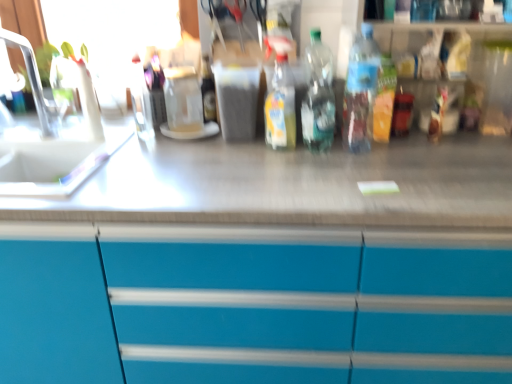
This screenshot has height=384, width=512. Identify the location of transparent plastic bottle at center, which ranks as the second bottle in right-to-left order. (318, 96).

The height and width of the screenshot is (384, 512). What do you see at coordinates (141, 100) in the screenshot? I see `clear plastic bottle at upper center, marked as the 1th bottle in a left-to-right arrangement` at bounding box center [141, 100].

You are a GUI agent. You are given a task and a screenshot of the screen. Output one action in this format:
    pyautogui.click(x=<x>, y=<y>)
    Task: Click on the transparent glass jar at center
    This screenshot has width=512, height=384.
    Given the screenshot: What is the action you would take?
    pyautogui.click(x=183, y=99)

Describe the element at coordinates (252, 305) in the screenshot. The height and width of the screenshot is (384, 512). I see `blue glossy cabinet at lower center` at that location.

The image size is (512, 384). What do you see at coordinates (361, 91) in the screenshot?
I see `translucent plastic bottle at center, which ranks as the fourth bottle in left-to-right order` at bounding box center [361, 91].

This screenshot has height=384, width=512. I want to click on translucent plastic bottle at center, the 3th bottle positioned from the right, so click(x=281, y=106).

Can you confirm if blue glossy cabinet at lower center is thinner than transparent glass jar at center?

No.

From the image's perspective, which is below, blue glossy cabinet at lower center or transparent glass jar at center?

blue glossy cabinet at lower center is shown below in the image.

In the scene shown: Is blue glossy cabinet at lower center in contact with transparent glass jar at center?

No, blue glossy cabinet at lower center is not in contact with transparent glass jar at center.

Can transparent glass jar at center be found inside blue glossy cabinet at lower center?

No, transparent glass jar at center is not inside blue glossy cabinet at lower center.

Is transparent plastic bottle at center, positioned as the third bottle in left-to-right order, positioned beyond the bounds of white plastic faucet at left?

Yes, transparent plastic bottle at center, positioned as the third bottle in left-to-right order, is not within white plastic faucet at left.

Considering the relative sizes of transparent plastic bottle at center, positioned as the third bottle in left-to-right order, and white plastic faucet at left in the image provided, is transparent plastic bottle at center, positioned as the third bottle in left-to-right order, shorter than white plastic faucet at left?

Yes.

Considering the positions of objects transparent plastic bottle at center, which ranks as the second bottle in right-to-left order, and white plastic faucet at left in the image provided, who is more to the left, transparent plastic bottle at center, which ranks as the second bottle in right-to-left order, or white plastic faucet at left?

From the viewer's perspective, white plastic faucet at left appears more on the left side.

Measure the distance from translucent plastic bottle at center, the 3th bottle positioned from the right, to transparent glass jar at center.

12.30 inches.

Is translucent plastic bottle at center, the 3th bottle positioned from the right, inside the boundaries of transparent glass jar at center, or outside?

translucent plastic bottle at center, the 3th bottle positioned from the right, cannot be found inside transparent glass jar at center.

Is point (292, 86) behind point (190, 110)?

No, (292, 86) is closer to viewer.

From the image's perspective, count 1st bottles downward from the transparent glass jar at center and point to it. Please provide its 2D coordinates.

[(281, 106)]

Is clear plastic bottle at upper center, marked as the 1th bottle in a left-to-right arrangement, thinner than transparent glass jar at center?

Yes.

Looking at this image, from the image's perspective, is clear plastic bottle at upper center, marked as the 1th bottle in a left-to-right arrangement, located above transparent glass jar at center?

Yes, from the image's perspective, clear plastic bottle at upper center, marked as the 1th bottle in a left-to-right arrangement, is above transparent glass jar at center.

Between clear plastic bottle at upper center, marked as the 1th bottle in a left-to-right arrangement, and transparent glass jar at center, which one has less height?

With less height is transparent glass jar at center.

Looking at this image, is clear plastic bottle at upper center, the fourth bottle when ordered from right to left, located outside transparent glass jar at center?

Yes, clear plastic bottle at upper center, the fourth bottle when ordered from right to left, is located beyond the bounds of transparent glass jar at center.

Considering the sizes of objects translucent plastic bottle at center, positioned as the 1th bottle in right-to-left order, and transparent plastic bottle at center, which ranks as the second bottle in right-to-left order, in the image provided, who is bigger, translucent plastic bottle at center, positioned as the 1th bottle in right-to-left order, or transparent plastic bottle at center, which ranks as the second bottle in right-to-left order,?

With larger size is translucent plastic bottle at center, positioned as the 1th bottle in right-to-left order.

Considering the relative sizes of translucent plastic bottle at center, positioned as the 1th bottle in right-to-left order, and transparent plastic bottle at center, which ranks as the second bottle in right-to-left order, in the image provided, is translucent plastic bottle at center, positioned as the 1th bottle in right-to-left order, shorter than transparent plastic bottle at center, which ranks as the second bottle in right-to-left order,?

In fact, translucent plastic bottle at center, positioned as the 1th bottle in right-to-left order, may be taller than transparent plastic bottle at center, which ranks as the second bottle in right-to-left order.

From a real-world perspective, which object stands above the other?

translucent plastic bottle at center, which ranks as the fourth bottle in left-to-right order, from a real-world perspective.

How many degrees apart are the facing directions of white plastic faucet at left and translucent plastic bottle at center, which is the 2th bottle from left to right?

19.1 degrees.

Would you say white plastic faucet at left is a long distance from translucent plastic bottle at center, the 3th bottle positioned from the right?

Actually, white plastic faucet at left and translucent plastic bottle at center, the 3th bottle positioned from the right, are a little close together.

Considering the sizes of objects white plastic faucet at left and translucent plastic bottle at center, which is the 2th bottle from left to right, in the image provided, who is wider, white plastic faucet at left or translucent plastic bottle at center, which is the 2th bottle from left to right,?

Wider between the two is white plastic faucet at left.

Is white plastic faucet at left facing away from translucent plastic bottle at center, the 3th bottle positioned from the right?

No, white plastic faucet at left is not facing away from translucent plastic bottle at center, the 3th bottle positioned from the right.

Which of these two, transparent glass jar at center or translucent plastic bottle at center, the 3th bottle positioned from the right, stands taller?

Standing taller between the two is translucent plastic bottle at center, the 3th bottle positioned from the right.

Could you tell me if transparent glass jar at center is facing translucent plastic bottle at center, which is the 2th bottle from left to right?

No, transparent glass jar at center does not turn towards translucent plastic bottle at center, which is the 2th bottle from left to right.

Is transparent glass jar at center positioned in front of translucent plastic bottle at center, the 3th bottle positioned from the right?

No, it is not.

Does transparent glass jar at center have a lesser width compared to translucent plastic bottle at center, the 3th bottle positioned from the right?

In fact, transparent glass jar at center might be wider than translucent plastic bottle at center, the 3th bottle positioned from the right.

The image size is (512, 384). Identify the location of beverage above the blue glossy cabinet at lower center (from the image's perspective). (183, 99).

At what (x,y) coordinates should I click in order to perform the action: click on bottle that is the 3rd one when counting downward from the white plastic faucet at left (from the image's perspective). Please return your answer as a coordinate pair (x, y). Looking at the image, I should click on (318, 96).

Considering their positions, is clear plastic bottle at upper center, marked as the 1th bottle in a left-to-right arrangement, positioned further to translucent plastic bottle at center, positioned as the 1th bottle in right-to-left order, than blue glossy cabinet at lower center?

clear plastic bottle at upper center, marked as the 1th bottle in a left-to-right arrangement, is further to translucent plastic bottle at center, positioned as the 1th bottle in right-to-left order.

In the scene shown: Considering their positions, is transparent plastic bottle at center, positioned as the third bottle in left-to-right order, positioned further to transparent glass jar at center than clear plastic bottle at upper center, marked as the 1th bottle in a left-to-right arrangement?

The object further to transparent glass jar at center is transparent plastic bottle at center, positioned as the third bottle in left-to-right order.

Which object lies nearer to the anchor point white plastic faucet at left, clear plastic bottle at upper center, the fourth bottle when ordered from right to left, or translucent plastic bottle at center, the 3th bottle positioned from the right?

Based on the image, clear plastic bottle at upper center, the fourth bottle when ordered from right to left, appears to be nearer to white plastic faucet at left.

When comparing their distances from transparent plastic bottle at center, positioned as the third bottle in left-to-right order, does clear plastic bottle at upper center, marked as the 1th bottle in a left-to-right arrangement, or translucent plastic bottle at center, which ranks as the fourth bottle in left-to-right order, seem closer?

translucent plastic bottle at center, which ranks as the fourth bottle in left-to-right order, is positioned closer to the anchor transparent plastic bottle at center, positioned as the third bottle in left-to-right order.

Considering their positions, is translucent plastic bottle at center, positioned as the 1th bottle in right-to-left order, positioned further to clear plastic bottle at upper center, marked as the 1th bottle in a left-to-right arrangement, than translucent plastic bottle at center, which is the 2th bottle from left to right?

translucent plastic bottle at center, positioned as the 1th bottle in right-to-left order.

Which object lies nearer to the anchor point translucent plastic bottle at center, positioned as the 1th bottle in right-to-left order, clear plastic bottle at upper center, the fourth bottle when ordered from right to left, or translucent plastic bottle at center, the 3th bottle positioned from the right?

translucent plastic bottle at center, the 3th bottle positioned from the right.

Which object lies nearer to the anchor point blue glossy cabinet at lower center, white plastic faucet at left or transparent glass jar at center?

transparent glass jar at center lies closer to blue glossy cabinet at lower center than the other object.

Which object lies nearer to the anchor point clear plastic bottle at upper center, marked as the 1th bottle in a left-to-right arrangement, transparent glass jar at center or transparent plastic bottle at center, which ranks as the second bottle in right-to-left order?

transparent glass jar at center lies closer to clear plastic bottle at upper center, marked as the 1th bottle in a left-to-right arrangement, than the other object.

Locate an element on the screen. beverage between clear plastic bottle at upper center, the fourth bottle when ordered from right to left, and blue glossy cabinet at lower center, in the vertical direction is located at coordinates (183, 99).

Where is `beverage between clear plastic bottle at upper center, the fourth bottle when ordered from right to left, and transparent plastic bottle at center, which ranks as the second bottle in right-to-left order, in the horizontal direction`? The width and height of the screenshot is (512, 384). beverage between clear plastic bottle at upper center, the fourth bottle when ordered from right to left, and transparent plastic bottle at center, which ranks as the second bottle in right-to-left order, in the horizontal direction is located at coordinates (183, 99).

Where is `bottle between translucent plastic bottle at center, which is the 2th bottle from left to right, and translucent plastic bottle at center, positioned as the 1th bottle in right-to-left order`? This screenshot has width=512, height=384. bottle between translucent plastic bottle at center, which is the 2th bottle from left to right, and translucent plastic bottle at center, positioned as the 1th bottle in right-to-left order is located at coordinates (318, 96).

Identify the location of beverage between clear plastic bottle at upper center, the fourth bottle when ordered from right to left, and translucent plastic bottle at center, the 3th bottle positioned from the right. (183, 99).